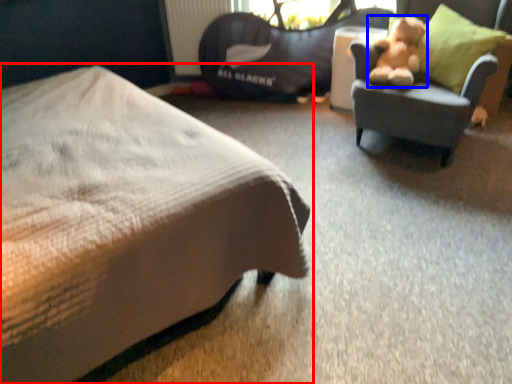
Question: Which point is further to the camera, bed (highlighted by a red box) or teddy bear (highlighted by a blue box)?

Choices:
 (A) bed
 (B) teddy bear

Answer: (B)